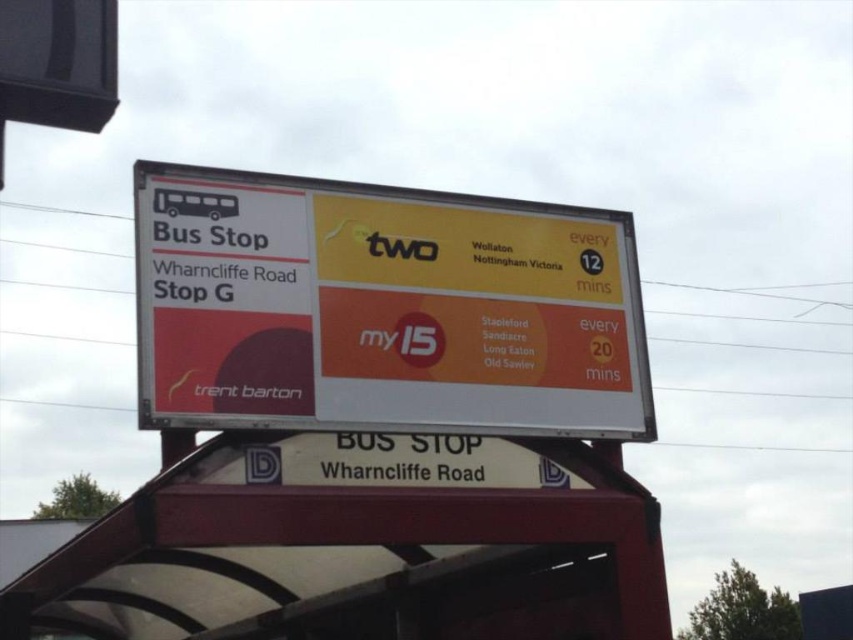
Question: Which point is farther from the camera taking this photo?

Choices:
 (A) [608, 481]
 (B) [213, 209]

Answer: (A)

Question: Is white plastic signboard at upper center bigger than white plastic bus stop at center?

Choices:
 (A) no
 (B) yes

Answer: (A)

Question: Where is white plastic signboard at upper center located in relation to white plastic bus stop at center in the image?

Choices:
 (A) above
 (B) below

Answer: (A)

Question: Which point is closer to the camera?

Choices:
 (A) white plastic bus stop at center
 (B) white plastic signboard at upper center

Answer: (A)

Question: Can you confirm if white plastic signboard at upper center is positioned to the right of white plastic bus stop at center?

Choices:
 (A) yes
 (B) no

Answer: (A)